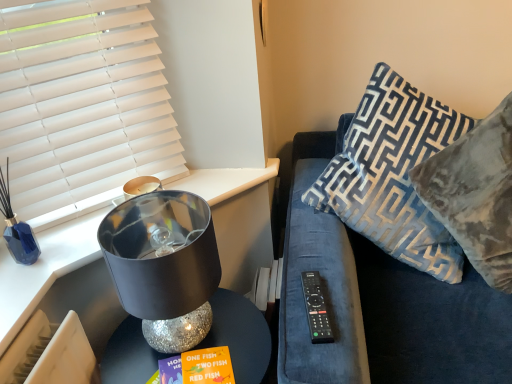
Question: Considering the relative sizes of black plastic remote at right and white matte window blind at upper left in the image provided, is black plastic remote at right shorter than white matte window blind at upper left?

Choices:
 (A) no
 (B) yes

Answer: (B)

Question: Does black plastic remote at right have a greater width compared to white matte window blind at upper left?

Choices:
 (A) no
 (B) yes

Answer: (B)

Question: From a real-world perspective, is black plastic remote at right physically above white matte window blind at upper left?

Choices:
 (A) yes
 (B) no

Answer: (B)

Question: Could white matte window blind at upper left be considered to be inside black plastic remote at right?

Choices:
 (A) no
 (B) yes

Answer: (A)

Question: Considering the relative sizes of black plastic remote at right and white matte window blind at upper left in the image provided, is black plastic remote at right smaller than white matte window blind at upper left?

Choices:
 (A) no
 (B) yes

Answer: (B)

Question: From the image's perspective, is white matte window blind at upper left positioned above or below velvet blue couch at right?

Choices:
 (A) below
 (B) above

Answer: (B)

Question: Considering their positions, is white matte window blind at upper left located in front of or behind velvet blue couch at right?

Choices:
 (A) behind
 (B) front

Answer: (A)

Question: Based on their positions, is white matte window blind at upper left located to the left or right of velvet blue couch at right?

Choices:
 (A) left
 (B) right

Answer: (A)

Question: In terms of height, does white matte window blind at upper left look taller or shorter compared to velvet blue couch at right?

Choices:
 (A) tall
 (B) short

Answer: (B)

Question: From a real-world perspective, is sparkly silver table at lower left physically located above or below velvet blue couch at right?

Choices:
 (A) above
 (B) below

Answer: (B)

Question: Is sparkly silver table at lower left in front of or behind velvet blue couch at right in the image?

Choices:
 (A) front
 (B) behind

Answer: (B)

Question: Considering the positions of sparkly silver table at lower left and velvet blue couch at right in the image, is sparkly silver table at lower left wider or thinner than velvet blue couch at right?

Choices:
 (A) thin
 (B) wide

Answer: (A)

Question: Is sparkly silver table at lower left bigger or smaller than velvet blue couch at right?

Choices:
 (A) big
 (B) small

Answer: (B)

Question: Does point (132, 331) appear closer or farther from the camera than point (174, 221)?

Choices:
 (A) farther
 (B) closer

Answer: (A)

Question: Considering the positions of sparkly silver table at lower left and shiny metallic lampshade at left in the image, is sparkly silver table at lower left bigger or smaller than shiny metallic lampshade at left?

Choices:
 (A) big
 (B) small

Answer: (A)